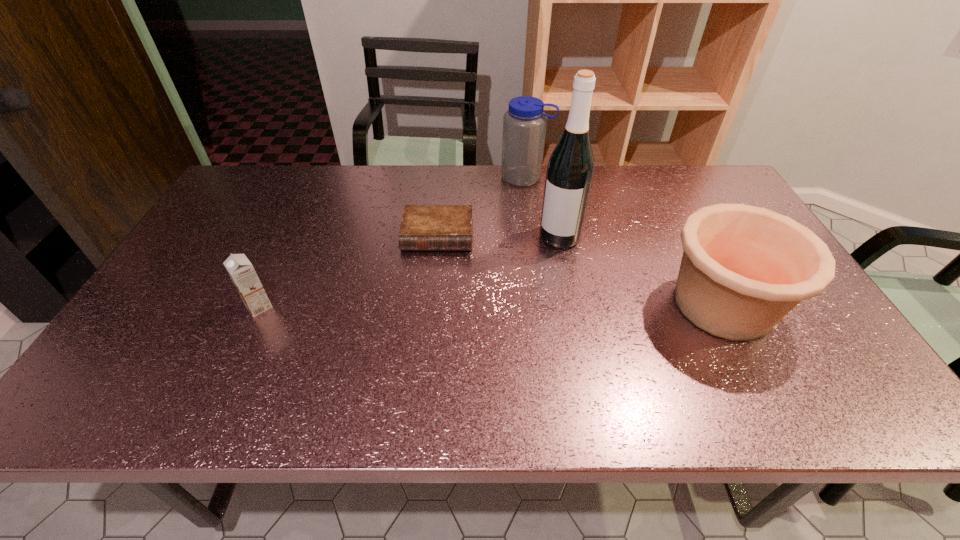
I want to click on vacant space on the desktop that is between the fourth tallest object and the third tallest object and is positioned with a carrying loop on the side of the fourth shortest object, so click(428, 306).

Identify the location of vacant space on the desktop that is between the fourth tallest object and the rightmost object and is positioned on the spine side of the shortest object. (430, 306).

At what (x,y) coordinates should I click in order to perform the action: click on free spot on the desktop that is between the leftmost object and the third tallest object and is positioned on the label of the tallest object. Please return your answer as a coordinate pair (x, y). The image size is (960, 540). Looking at the image, I should click on (521, 305).